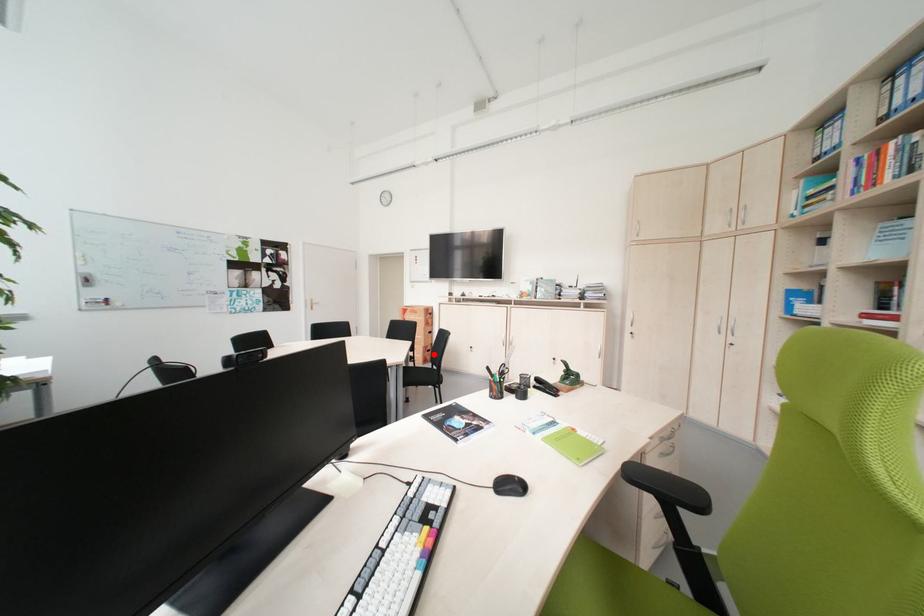
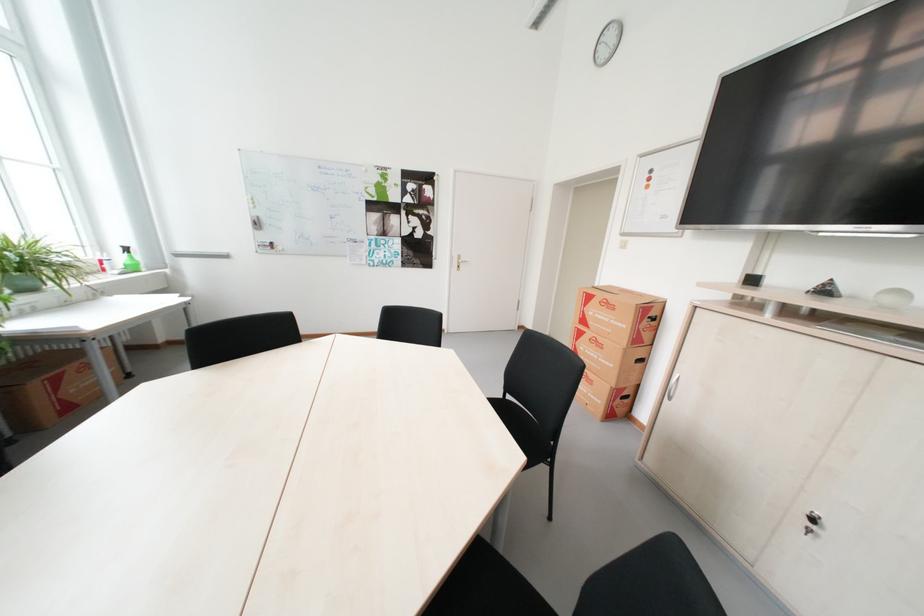
Locate, in the second image, the point that corresponds to the highlighted location in the first image.

(622, 400)